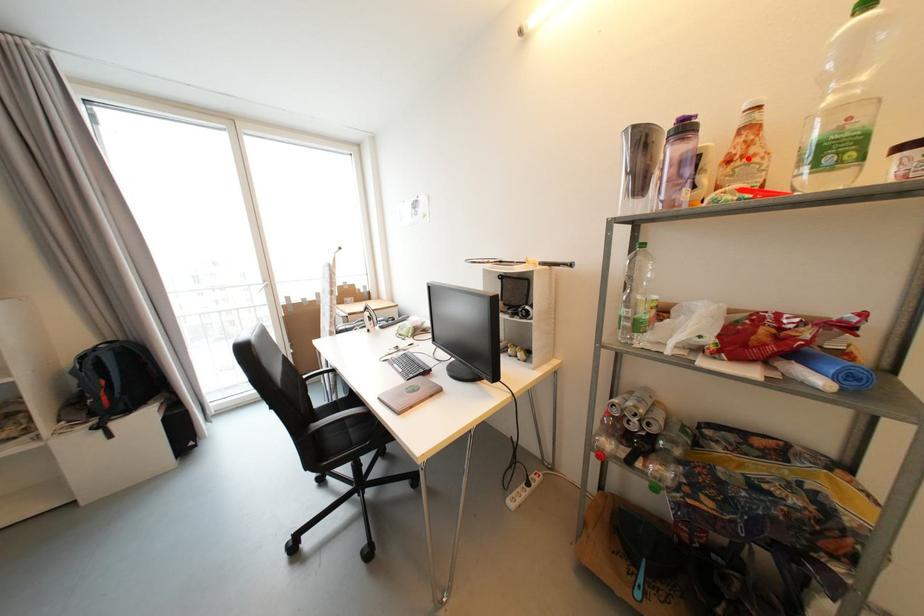
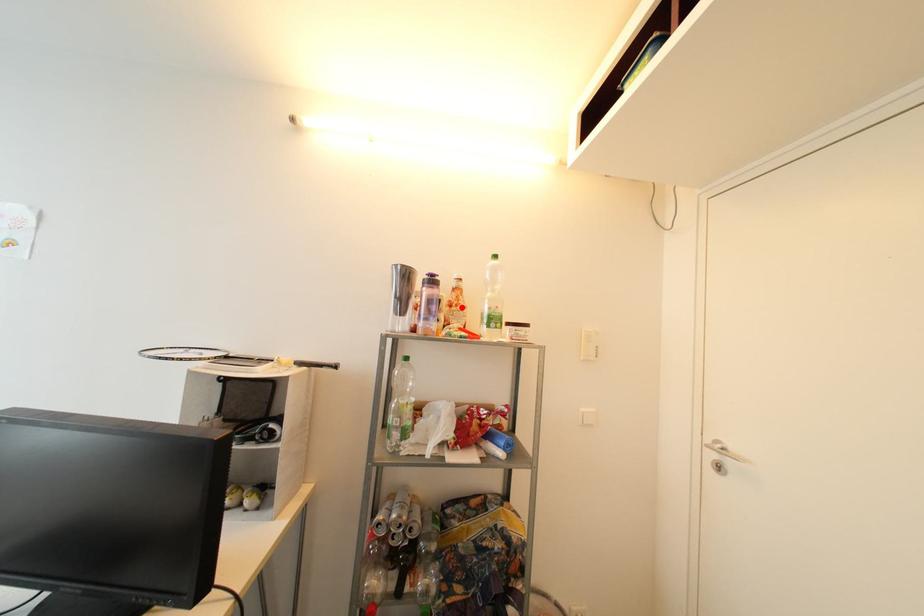
I am providing you with two images of the same scene from different viewpoints. A red point is marked on the first image and another point is marked on the second image. Are the points marked in image1 and image2 representing the same 3D position?

Yes